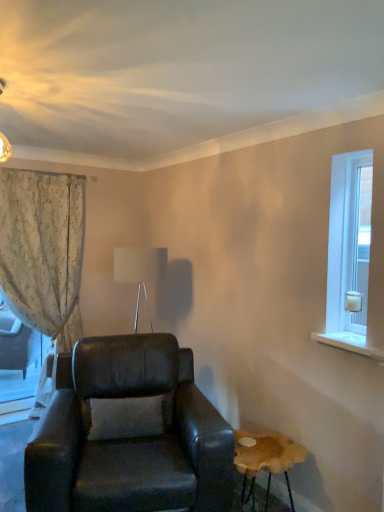
Question: From the image's perspective, is wooden stool at lower right over leather armchair at center?

Choices:
 (A) yes
 (B) no

Answer: (B)

Question: Could leather armchair at center be considered to be inside wooden stool at lower right?

Choices:
 (A) no
 (B) yes

Answer: (A)

Question: Can you confirm if wooden stool at lower right is taller than leather armchair at center?

Choices:
 (A) yes
 (B) no

Answer: (B)

Question: Can you confirm if wooden stool at lower right is bigger than leather armchair at center?

Choices:
 (A) yes
 (B) no

Answer: (B)

Question: Is wooden stool at lower right at the left side of leather armchair at center?

Choices:
 (A) yes
 (B) no

Answer: (B)

Question: In terms of width, does clear glass door at right look wider or thinner when compared to floral fabric curtain at left?

Choices:
 (A) wide
 (B) thin

Answer: (B)

Question: Is point coord(367,283) positioned closer to the camera than point coord(79,221)?

Choices:
 (A) closer
 (B) farther

Answer: (A)

Question: Choose the correct answer: Is clear glass door at right inside floral fabric curtain at left or outside it?

Choices:
 (A) outside
 (B) inside

Answer: (A)

Question: Based on their positions, is clear glass door at right located to the left or right of floral fabric curtain at left?

Choices:
 (A) right
 (B) left

Answer: (A)

Question: Is wooden stool at lower right bigger or smaller than leather armchair at center?

Choices:
 (A) big
 (B) small

Answer: (B)

Question: In terms of height, does wooden stool at lower right look taller or shorter compared to leather armchair at center?

Choices:
 (A) short
 (B) tall

Answer: (A)

Question: Choose the correct answer: Is wooden stool at lower right inside leather armchair at center or outside it?

Choices:
 (A) outside
 (B) inside

Answer: (A)

Question: Relative to leather armchair at center, is wooden stool at lower right in front or behind?

Choices:
 (A) behind
 (B) front

Answer: (A)

Question: From the image's perspective, is clear glass door at right positioned above or below wooden stool at lower right?

Choices:
 (A) below
 (B) above

Answer: (B)

Question: In terms of height, does clear glass door at right look taller or shorter compared to wooden stool at lower right?

Choices:
 (A) tall
 (B) short

Answer: (A)